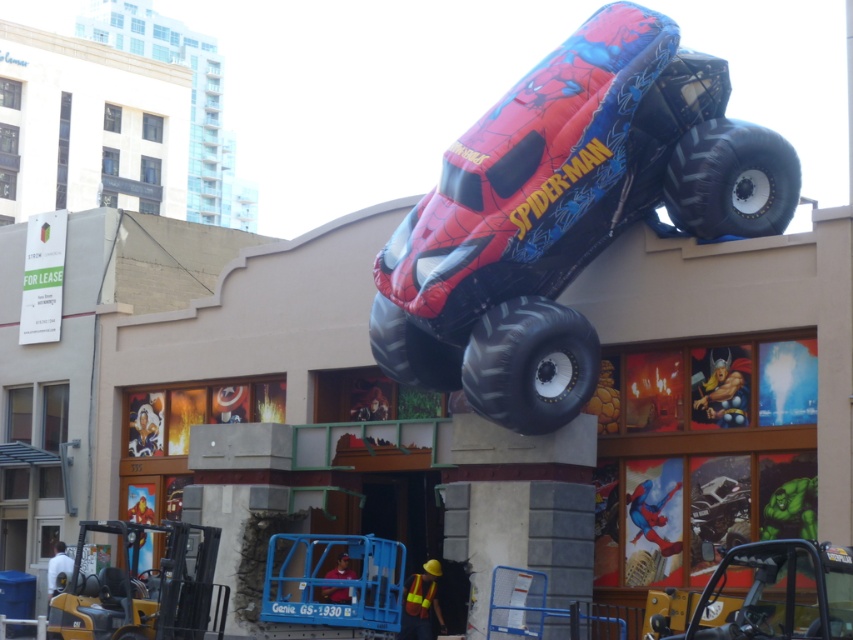
Can you confirm if black rubber tire at lower center is positioned below black rubber tire at upper right?

Yes.

Looking at this image, can you confirm if black rubber tire at lower center is bigger than black rubber tire at upper right?

No.

Is point (502, 340) in front of point (714, 154)?

Yes, it is.

What are the coordinates of `black rubber tire at lower center` in the screenshot? It's located at (531, 364).

Can you confirm if matte plastic spider-man monster truck at upper center is positioned below black rubber tire at upper right?

Indeed, matte plastic spider-man monster truck at upper center is positioned under black rubber tire at upper right.

Is point (714, 224) positioned before point (669, 163)?

Yes, it is.

Who is more forward, (547, 371) or (721, 218)?

Positioned in front is point (547, 371).

Locate an element on the screen. Image resolution: width=853 pixels, height=640 pixels. matte plastic spider-man monster truck at upper center is located at coordinates (566, 212).

Which is more to the left, matte plastic spider-man monster truck at upper center or rubber/soft tire at center?

Positioned to the left is rubber/soft tire at center.

Does point (573, 99) come farther from viewer compared to point (440, 376)?

No.

This screenshot has width=853, height=640. What do you see at coordinates (566, 212) in the screenshot? I see `matte plastic spider-man monster truck at upper center` at bounding box center [566, 212].

Where is `matte plastic spider-man monster truck at upper center`? matte plastic spider-man monster truck at upper center is located at coordinates (566, 212).